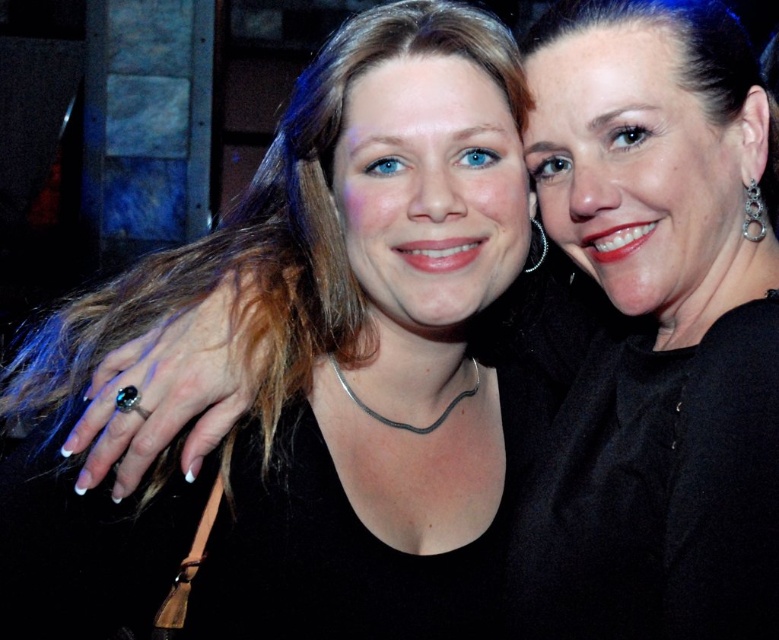
You are a photographer at a social event and need to adjust the lighting to highlight both the black matte necklace at center and the black matte dress at center. Since the necklace is positioned to the left of the dress, which object should you focus your light on first to ensure both are properly illuminated?

The black matte necklace at center is to the left of the black matte dress at center, so you should focus the light on the necklace first to ensure both are illuminated properly.

You are a photographer trying to focus on the black matte necklace at center and the black matte dress at center in the image. Which object should you adjust your focus to first if you want to ensure both are in focus?

The black matte dress at center is behind the black matte necklace at center, so you should focus on the black matte necklace at center first to ensure both are in focus.

You are a photographer adjusting the camera settings for a closeup shot of the two women. The camera can only focus on objects within a 10 inch range. Given that the black matte necklace at center and the black matte dress at center are both in the frame, will the camera be able to focus on both?

The black matte necklace at center and black matte dress at center are 12.68 inches apart from each other. Since the camera can only focus on objects within a 10 inch range, the camera will not be able to focus on both simultaneously.